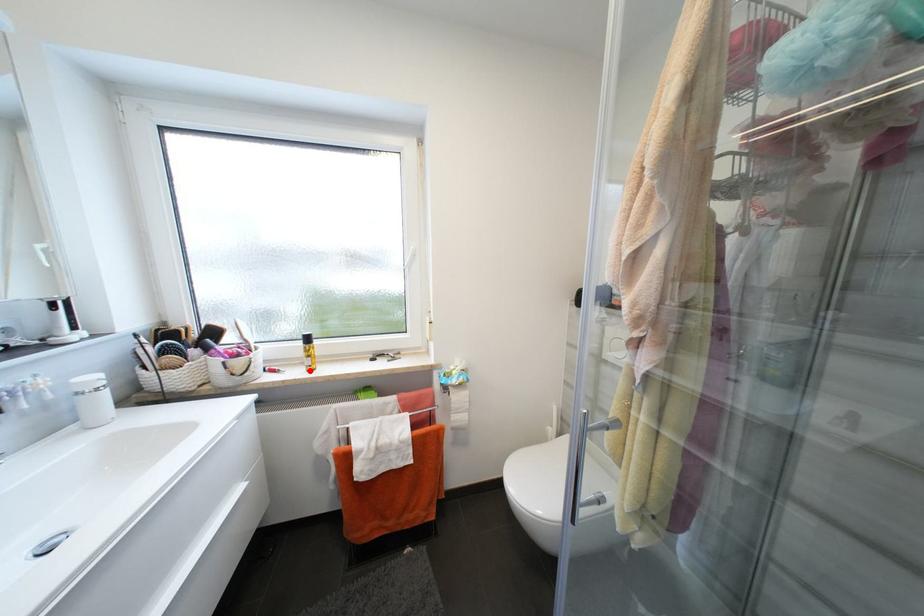
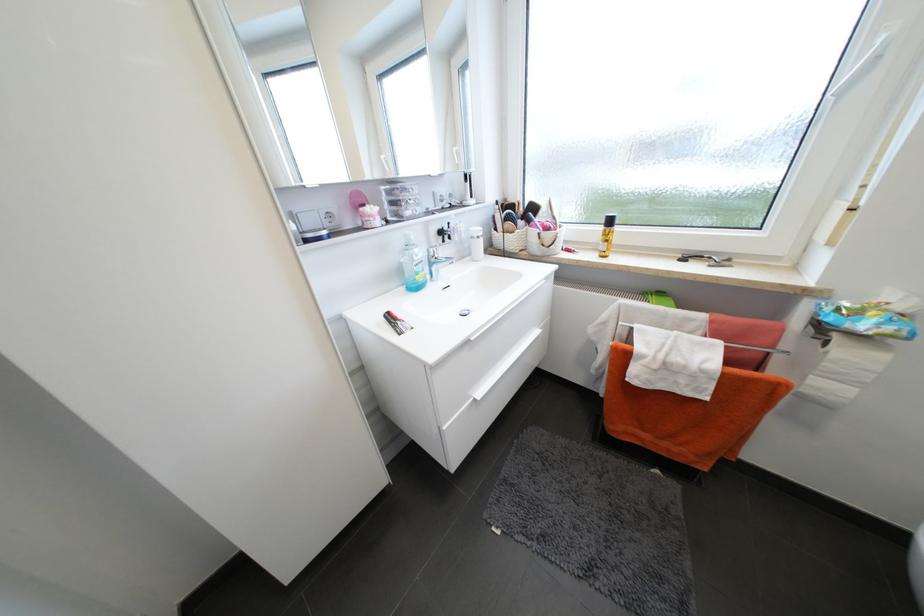
In the second image, find the point that corresponds to the highlighted location in the first image.

(602, 256)